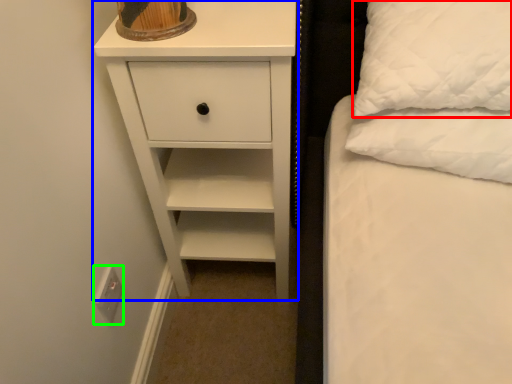
Question: Which object is positioned farthest from pillow (highlighted by a red box)? Select from chest of drawers (highlighted by a blue box) and electric outlet (highlighted by a green box).

Choices:
 (A) chest of drawers
 (B) electric outlet

Answer: (B)